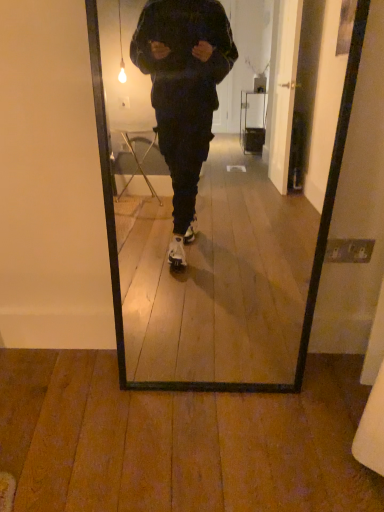
I want to click on white plastic power outlet at lower right, so click(x=349, y=250).

This screenshot has width=384, height=512. What do you see at coordinates (349, 250) in the screenshot?
I see `white plastic power outlet at lower right` at bounding box center [349, 250].

At what (x,y) coordinates should I click in order to perform the action: click on white plastic power outlet at lower right. Please return your answer as a coordinate pair (x, y). The image size is (384, 512). Looking at the image, I should click on (349, 250).